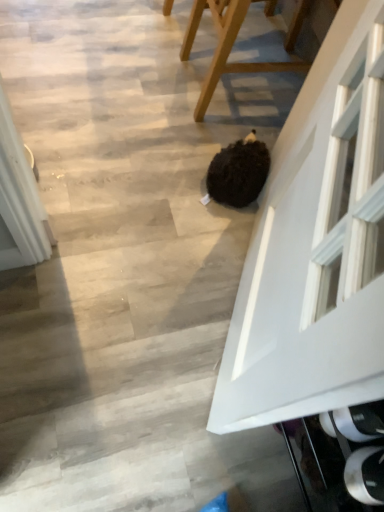
Where is `vacant space in front of white glossy door at center`? The width and height of the screenshot is (384, 512). vacant space in front of white glossy door at center is located at coordinates tap(159, 433).